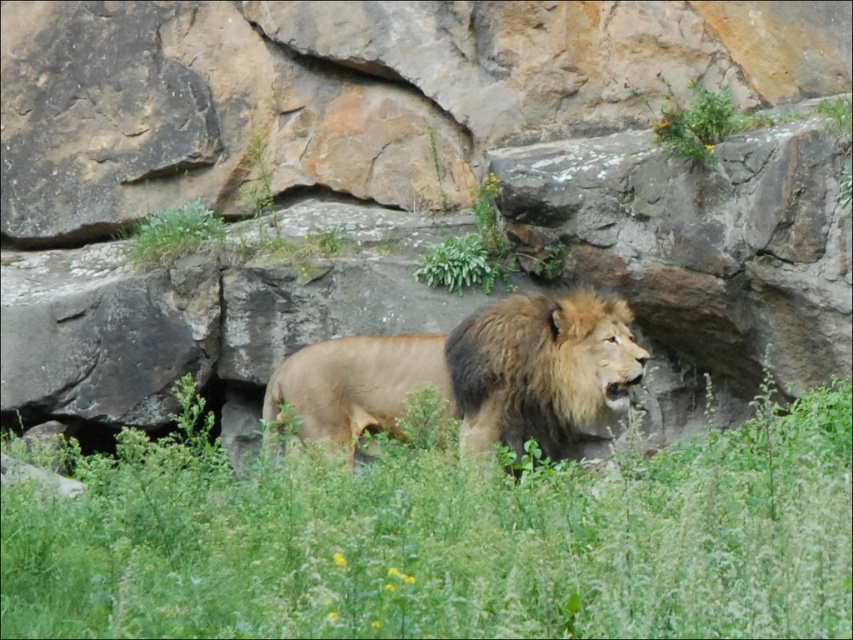
Can you confirm if green grassy at center is shorter than golden fur lion at center?

Yes, green grassy at center is shorter than golden fur lion at center.

Is point (807, 538) more distant than point (527, 364)?

No, it is in front of (527, 364).

Locate an element on the screen. green grassy at center is located at coordinates click(x=447, y=544).